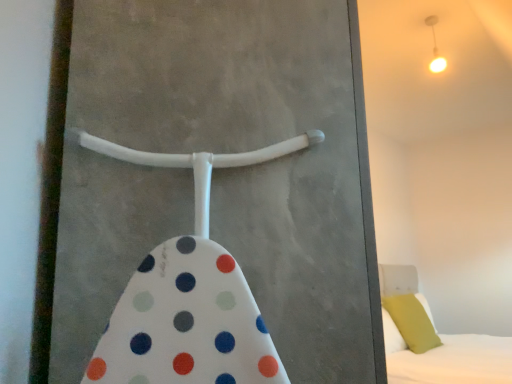
Question: Can you confirm if matte white light fixture at upper right is shorter than white plastic screen door at center?

Choices:
 (A) yes
 (B) no

Answer: (A)

Question: Does matte white light fixture at upper right appear on the right side of white plastic screen door at center?

Choices:
 (A) no
 (B) yes

Answer: (B)

Question: Is matte white light fixture at upper right next to white plastic screen door at center and touching it?

Choices:
 (A) yes
 (B) no

Answer: (B)

Question: From the image's perspective, is matte white light fixture at upper right on white plastic screen door at center?

Choices:
 (A) no
 (B) yes

Answer: (B)

Question: Considering the relative sizes of matte white light fixture at upper right and white plastic screen door at center in the image provided, is matte white light fixture at upper right thinner than white plastic screen door at center?

Choices:
 (A) no
 (B) yes

Answer: (B)

Question: From a real-world perspective, is matte white light fixture at upper right positioned above or below white soft bed at lower right?

Choices:
 (A) above
 (B) below

Answer: (A)

Question: Based on their positions, is matte white light fixture at upper right located to the left or right of white soft bed at lower right?

Choices:
 (A) left
 (B) right

Answer: (A)

Question: Is matte white light fixture at upper right inside or outside of white soft bed at lower right?

Choices:
 (A) outside
 (B) inside

Answer: (A)

Question: In terms of size, does matte white light fixture at upper right appear bigger or smaller than white soft bed at lower right?

Choices:
 (A) small
 (B) big

Answer: (A)

Question: Is white soft bed at lower right situated inside matte white light fixture at upper right or outside?

Choices:
 (A) outside
 (B) inside

Answer: (A)

Question: Is white soft bed at lower right to the left or to the right of matte white light fixture at upper right in the image?

Choices:
 (A) right
 (B) left

Answer: (A)

Question: In terms of width, does white soft bed at lower right look wider or thinner when compared to matte white light fixture at upper right?

Choices:
 (A) wide
 (B) thin

Answer: (A)

Question: Relative to matte white light fixture at upper right, is white soft bed at lower right in front or behind?

Choices:
 (A) front
 (B) behind

Answer: (A)

Question: Considering their positions, is white soft bed at lower right located in front of or behind soft green pillow at right?

Choices:
 (A) behind
 (B) front

Answer: (B)

Question: Is white soft bed at lower right to the left or to the right of soft green pillow at right in the image?

Choices:
 (A) left
 (B) right

Answer: (B)